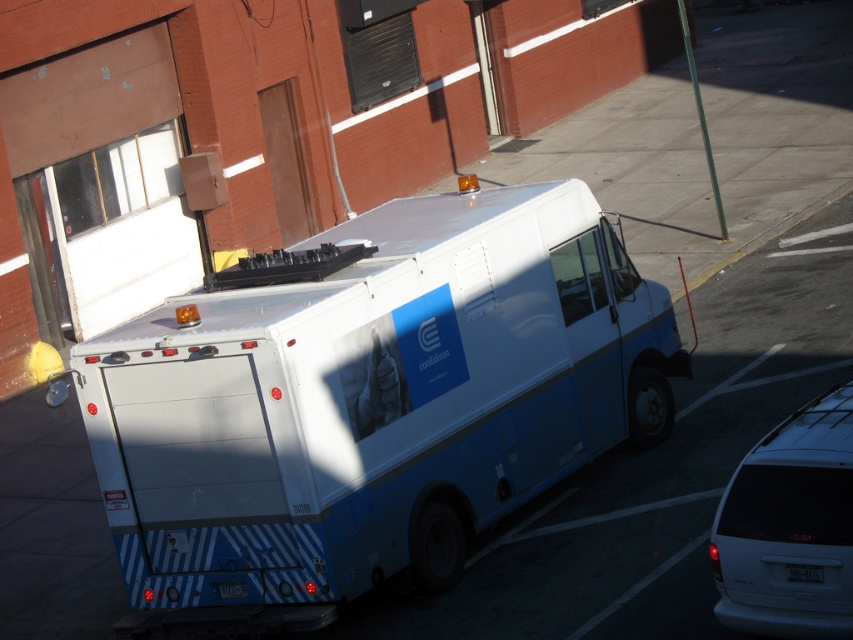
Is white glossy van at center shorter than white plastic license plate at rear?

No, white glossy van at center is not shorter than white plastic license plate at rear.

Between white glossy van at center and white plastic license plate at rear, which one is positioned higher?

white glossy van at center is above.

What do you see at coordinates (366, 403) in the screenshot? The image size is (853, 640). I see `white glossy van at center` at bounding box center [366, 403].

This screenshot has width=853, height=640. I want to click on white glossy van at center, so click(x=366, y=403).

Which is more to the right, white glossy van at center or black plastic license plate at center?

From the viewer's perspective, black plastic license plate at center appears more on the right side.

Locate an element on the screen. The width and height of the screenshot is (853, 640). white glossy van at center is located at coordinates (366, 403).

The width and height of the screenshot is (853, 640). I want to click on white glossy van at center, so click(366, 403).

Who is more distant from viewer, (838,456) or (222,580)?

Point (222,580)

Consider the image. Is white matte van at lower right wider than white plastic license plate at rear?

Indeed, white matte van at lower right has a greater width compared to white plastic license plate at rear.

Does point (776, 554) come closer to viewer compared to point (225, 595)?

Yes, it is in front of point (225, 595).

The width and height of the screenshot is (853, 640). I want to click on white matte van at lower right, so point(788,525).